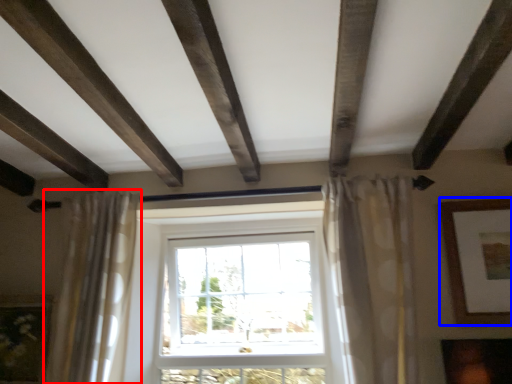
Question: Which of the following is the closest to the observer, curtain (highlighted by a red box) or picture frame (highlighted by a blue box)?

Choices:
 (A) curtain
 (B) picture frame

Answer: (A)